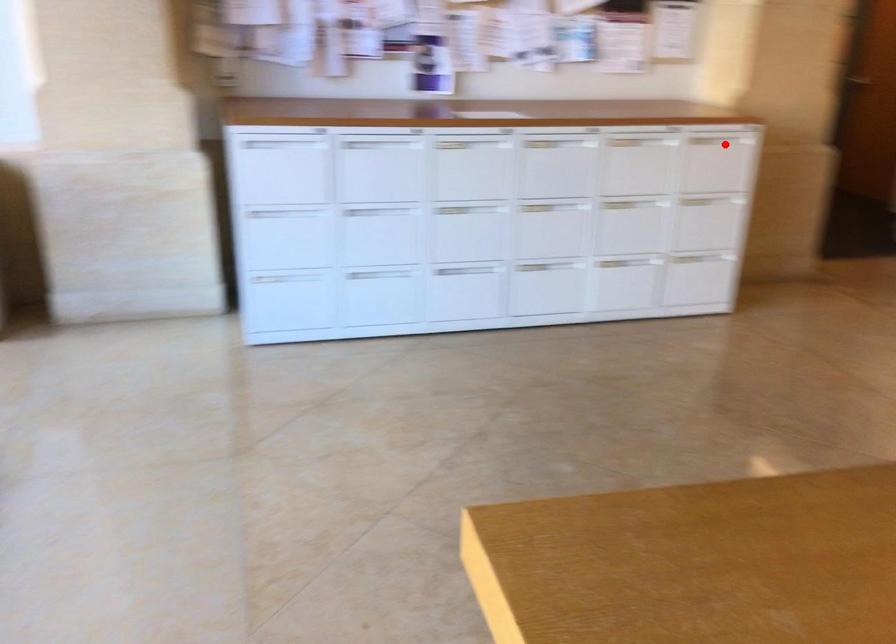
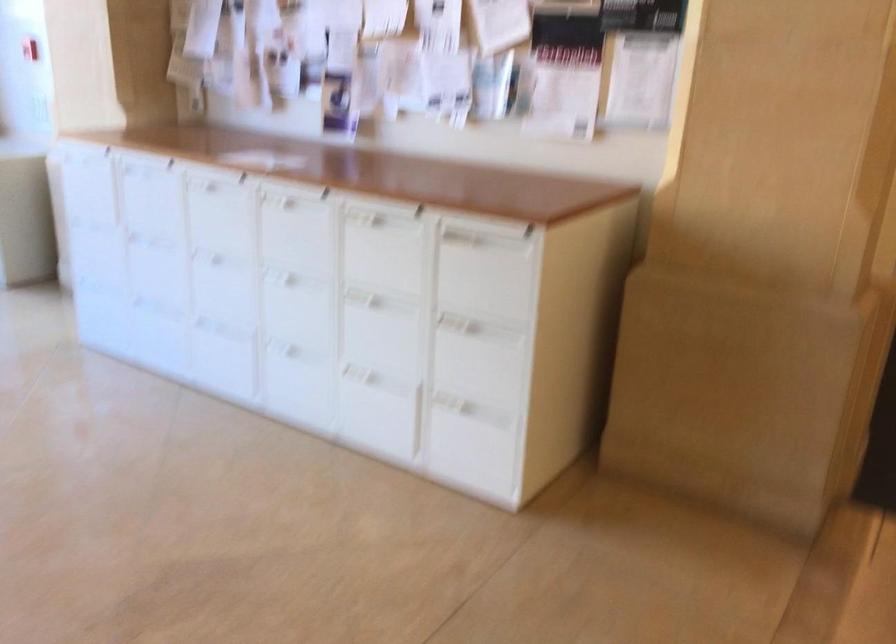
Question: I am providing you with two images of the same scene from different viewpoints. In image1, a red point is highlighted. Considering the same 3D point in image2, which of the following is correct?

Choices:
 (A) It is closer
 (B) It is farther

Answer: (A)